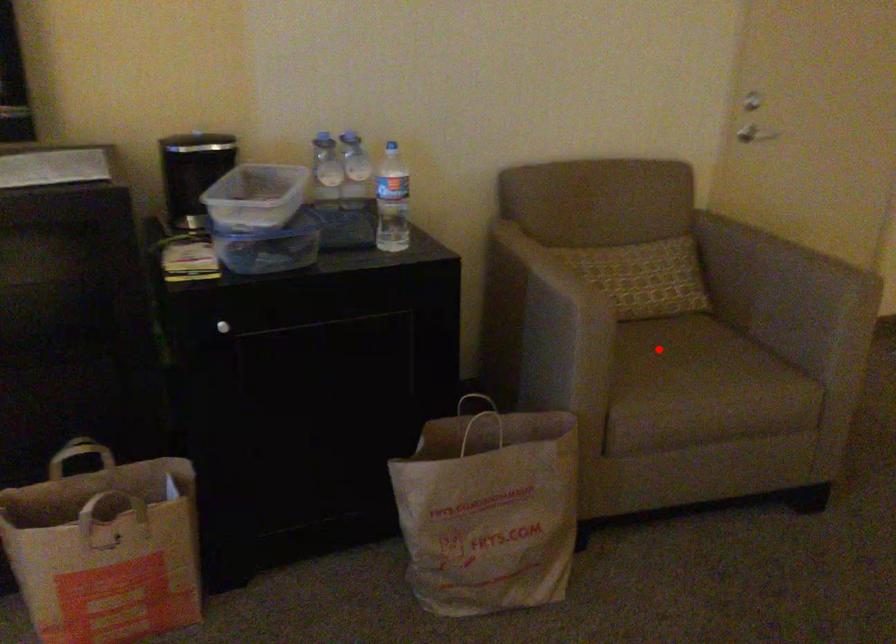
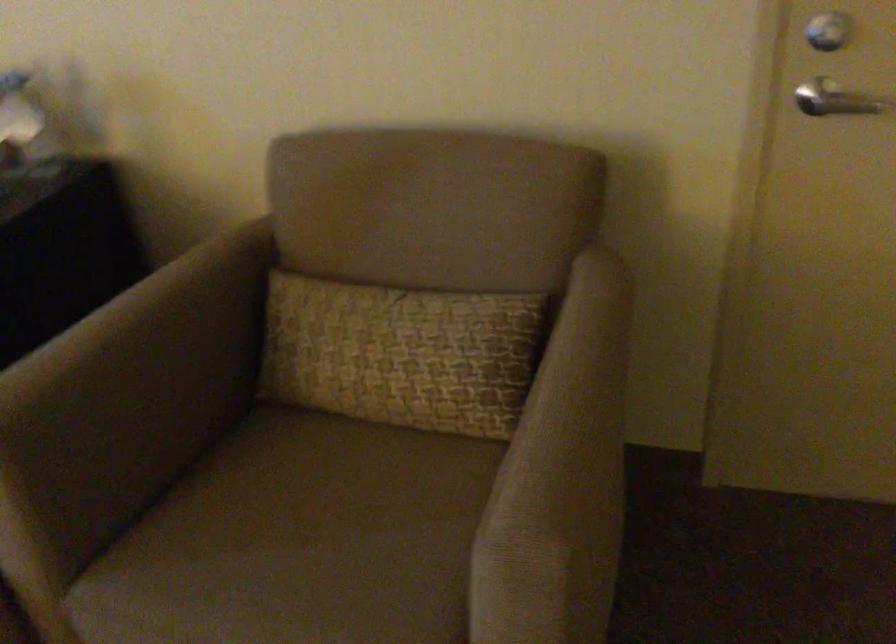
In the second image, find the point that corresponds to the highlighted location in the first image.

(314, 500)